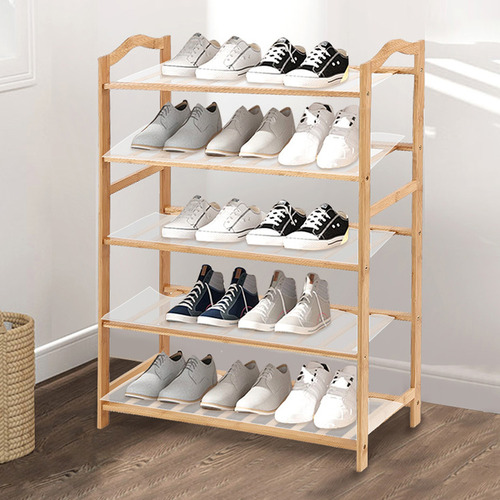
Identify the location of shoes on shelf from bottom. (336, 421), (311, 414), (266, 403), (232, 394), (181, 382), (157, 371).